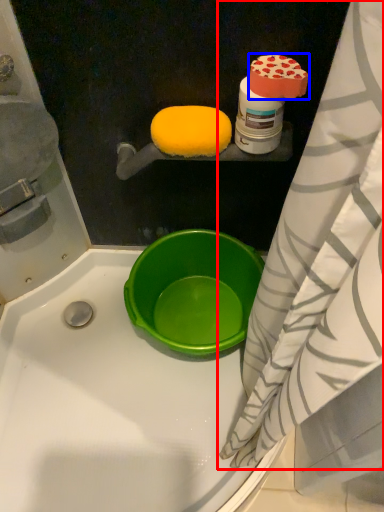
Question: Among these objects, which one is farthest to the camera, curtain (highlighted by a red box) or food (highlighted by a blue box)?

Choices:
 (A) curtain
 (B) food

Answer: (B)